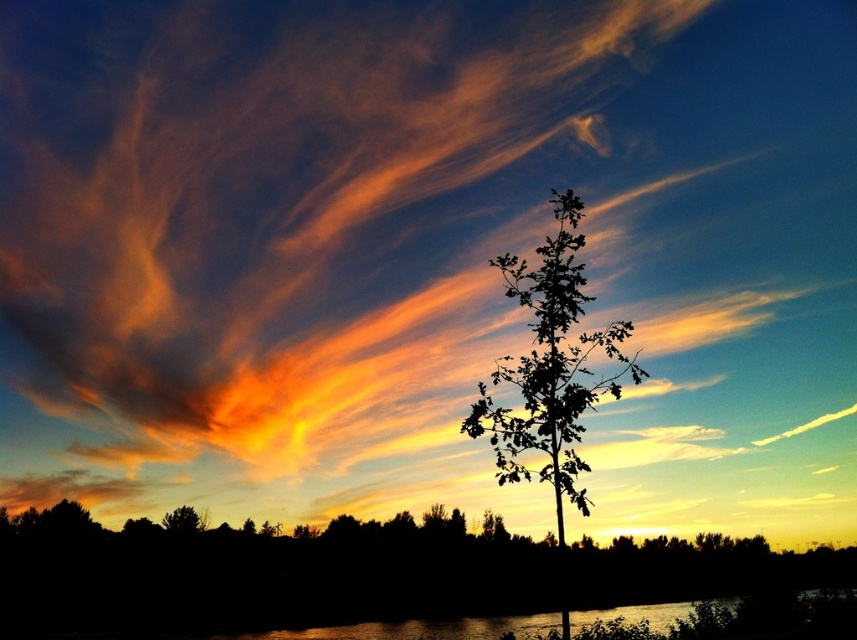
You are an observer looking at the sunset scene. There is a silhouette leafy tree at center and a green leafy tree at lower left. Which tree is closer to the observer?

The green leafy tree at lower left is closer to the observer because the silhouette leafy tree at center is positioned over it, indicating it is further away.